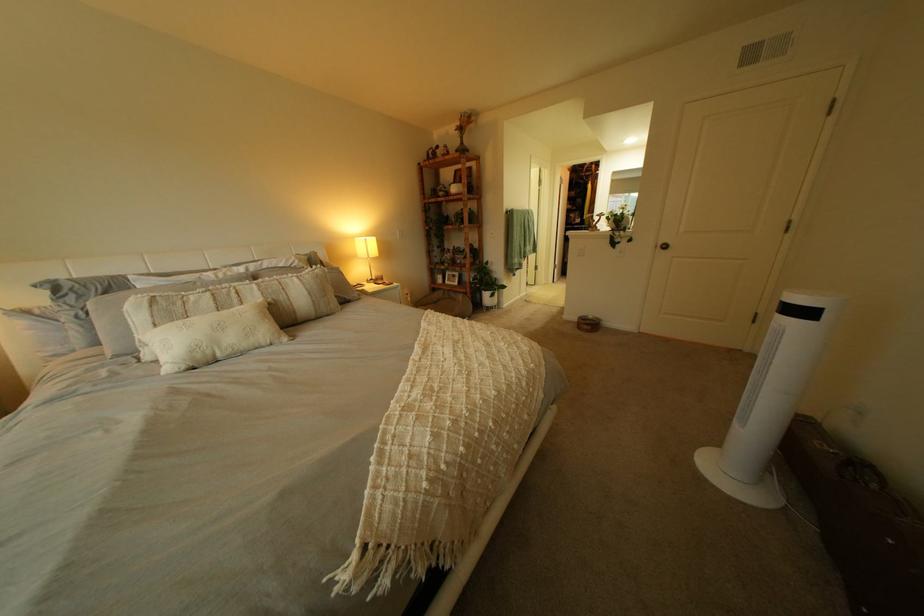
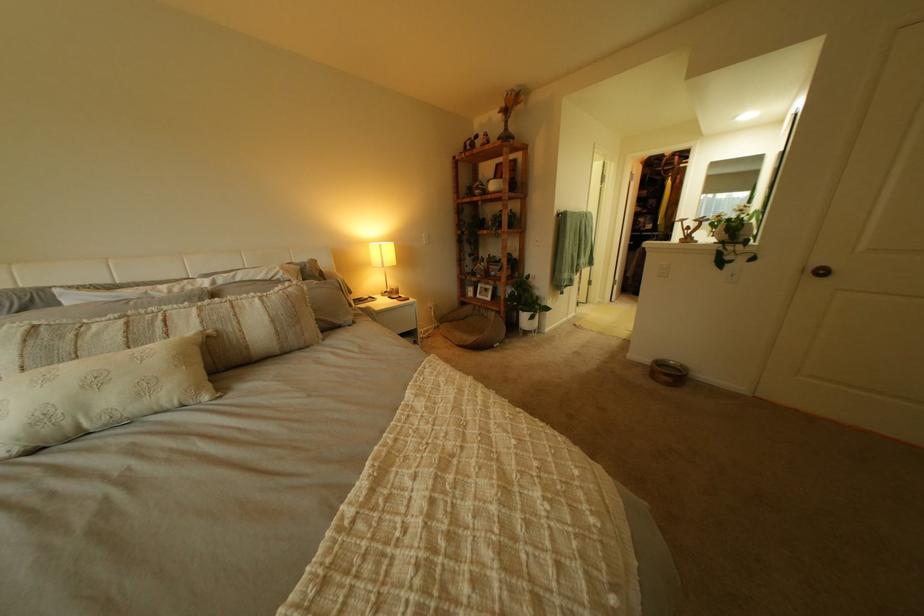
The point at (274, 294) is marked in the first image. Where is the corresponding point in the second image?

(213, 323)